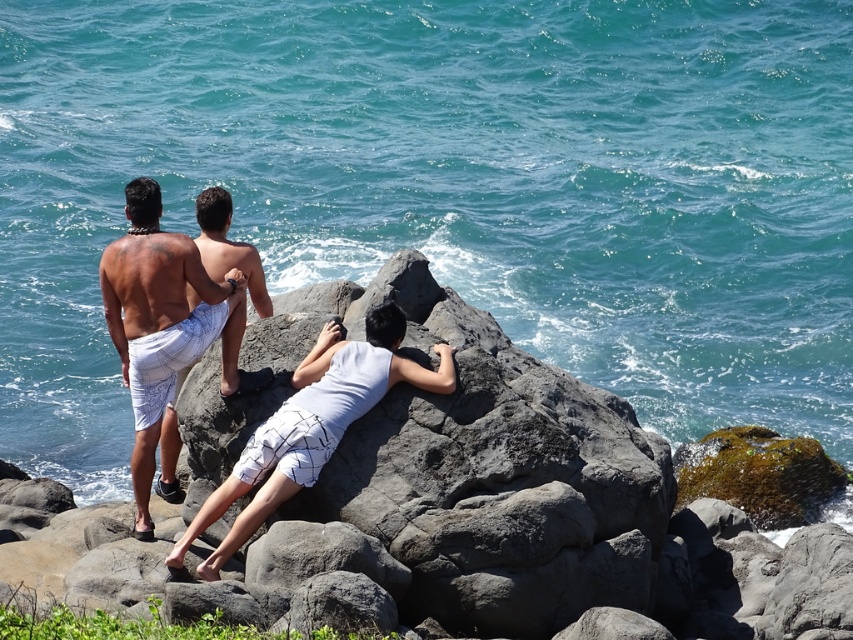
Which is more to the right, white mesh shorts at center or white printed shorts at left?

From the viewer's perspective, white mesh shorts at center appears more on the right side.

Is white mesh shorts at center wider than white printed shorts at left?

In fact, white mesh shorts at center might be narrower than white printed shorts at left.

Which is in front, point (444, 378) or point (157, 420)?

Point (444, 378)

Where is `white mesh shorts at center`? This screenshot has width=853, height=640. white mesh shorts at center is located at coordinates (312, 424).

Measure the distance between white printed shorts at left and camera.

white printed shorts at left is 137.54 feet from camera.

Is white printed shorts at left below white textured shorts at center?

Indeed, white printed shorts at left is positioned under white textured shorts at center.

Identify the location of white printed shorts at left. This screenshot has height=640, width=853. (157, 321).

Does gray rough rock at center have a greater height compared to white printed shorts at left?

No.

The width and height of the screenshot is (853, 640). What do you see at coordinates (438, 506) in the screenshot?
I see `gray rough rock at center` at bounding box center [438, 506].

Find the location of a particular element. gray rough rock at center is located at coordinates (438, 506).